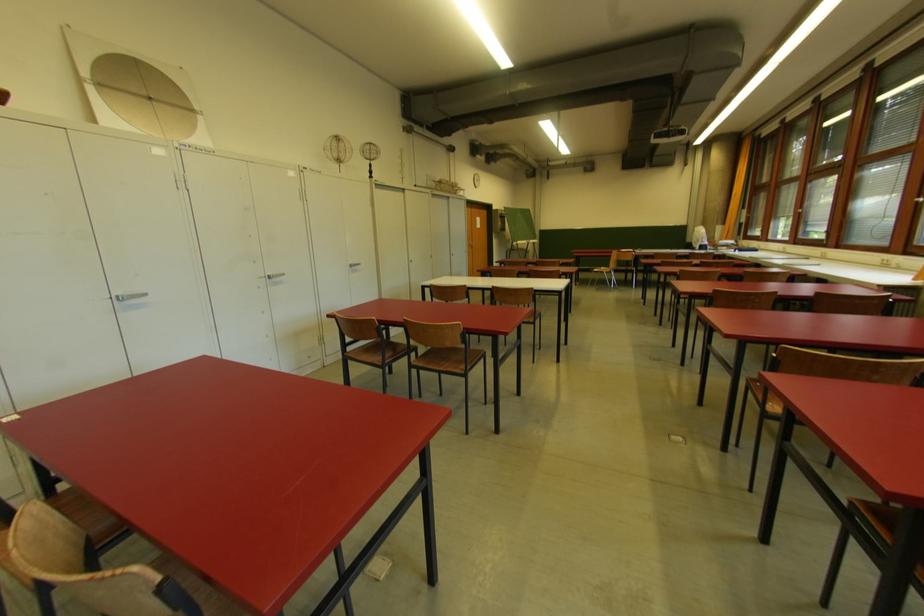
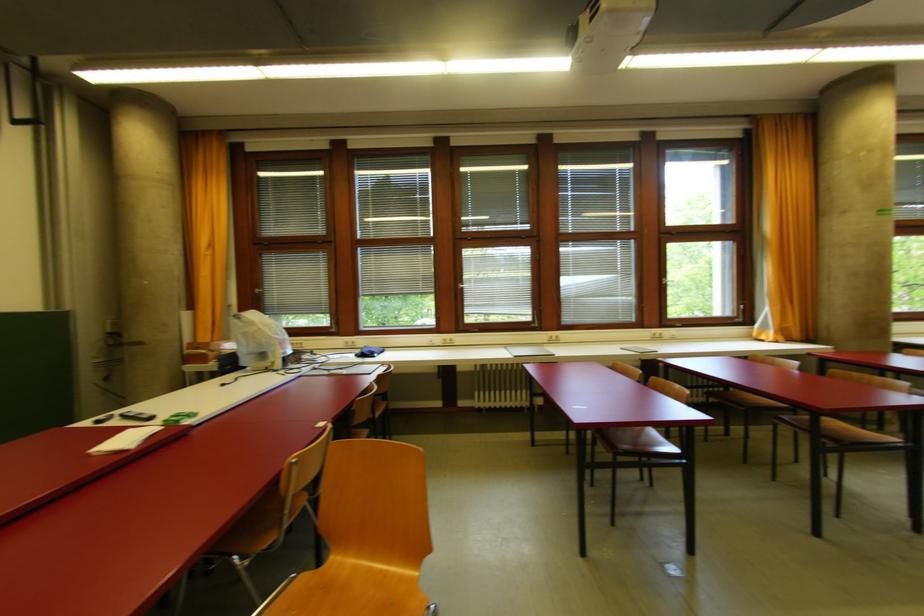
Find the pixel in the second image that matches [803,213] in the first image.

(465, 288)